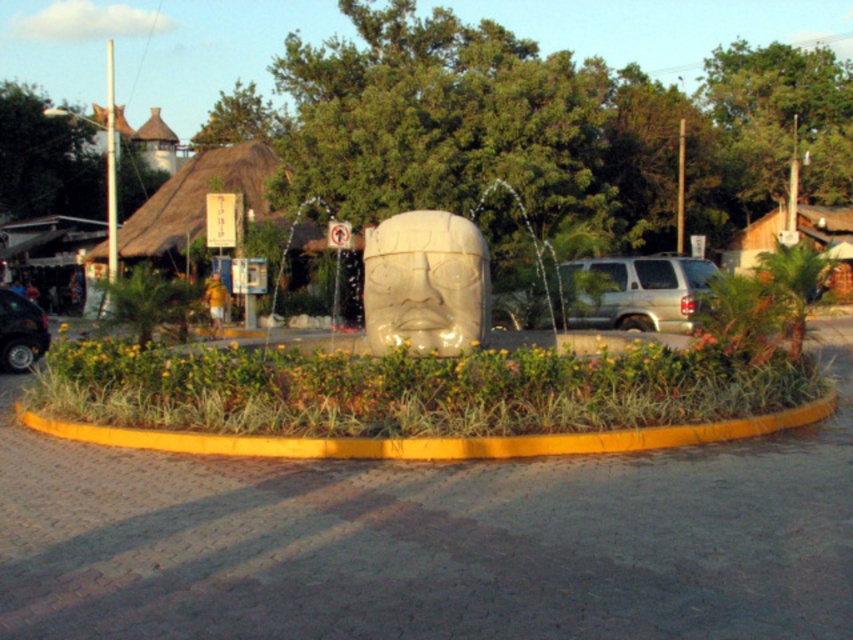
Is yellow painted curb at lower center below silver metallic suv at right?

Yes, yellow painted curb at lower center is below silver metallic suv at right.

Find the location of a particular element. The height and width of the screenshot is (640, 853). yellow painted curb at lower center is located at coordinates point(432,438).

Which is in front, point (361, 438) or point (651, 292)?

Point (361, 438)

Locate an element on the screen. Image resolution: width=853 pixels, height=640 pixels. yellow painted curb at lower center is located at coordinates (432, 438).

Does yellow painted curb at lower center have a greater width compared to shiny black car at lower left?

Incorrect, yellow painted curb at lower center's width does not surpass shiny black car at lower left's.

Is point (479, 442) farther from viewer compared to point (19, 362)?

That is False.

The height and width of the screenshot is (640, 853). I want to click on yellow painted curb at lower center, so click(x=432, y=438).

Is silver metallic suv at right smaller than shiny black car at lower left?

No.

Can you confirm if silver metallic suv at right is wider than shiny black car at lower left?

Indeed, silver metallic suv at right has a greater width compared to shiny black car at lower left.

Between point (683, 308) and point (4, 369), which one is positioned behind?

The point (4, 369) is more distant.

Locate an element on the screen. This screenshot has height=640, width=853. silver metallic suv at right is located at coordinates (636, 291).